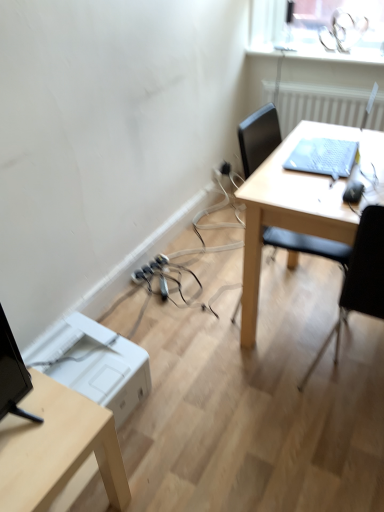
Question: Is black plastic extension cord at lower center smaller than black plastic chair at right?

Choices:
 (A) yes
 (B) no

Answer: (A)

Question: Does black plastic extension cord at lower center have a lesser height compared to black plastic chair at right?

Choices:
 (A) no
 (B) yes

Answer: (B)

Question: Can you confirm if black plastic extension cord at lower center is wider than black plastic chair at right?

Choices:
 (A) no
 (B) yes

Answer: (A)

Question: Is black plastic extension cord at lower center located outside black plastic chair at right?

Choices:
 (A) yes
 (B) no

Answer: (A)

Question: Is black plastic extension cord at lower center in front of black plastic chair at right?

Choices:
 (A) yes
 (B) no

Answer: (B)

Question: In the image, is light wood table at center positioned in front of or behind white plastic printer at lower left?

Choices:
 (A) front
 (B) behind

Answer: (A)

Question: In the image, is light wood table at center on the left side or the right side of white plastic printer at lower left?

Choices:
 (A) right
 (B) left

Answer: (A)

Question: Considering the positions of light wood table at center and white plastic printer at lower left in the image, is light wood table at center wider or thinner than white plastic printer at lower left?

Choices:
 (A) wide
 (B) thin

Answer: (A)

Question: From the image's perspective, is light wood table at center positioned above or below white plastic printer at lower left?

Choices:
 (A) below
 (B) above

Answer: (B)

Question: From the image's perspective, is white textured radiator at upper right above or below black plastic chair at right?

Choices:
 (A) above
 (B) below

Answer: (A)

Question: Considering the positions of white textured radiator at upper right and black plastic chair at right in the image, is white textured radiator at upper right bigger or smaller than black plastic chair at right?

Choices:
 (A) big
 (B) small

Answer: (B)

Question: Would you say white textured radiator at upper right is inside or outside black plastic chair at right?

Choices:
 (A) inside
 (B) outside

Answer: (B)

Question: In the image, is white textured radiator at upper right on the left side or the right side of black plastic chair at right?

Choices:
 (A) right
 (B) left

Answer: (B)

Question: Considering the positions of white plastic printer at lower left and black plastic chair at right in the image, is white plastic printer at lower left taller or shorter than black plastic chair at right?

Choices:
 (A) short
 (B) tall

Answer: (A)

Question: Considering the positions of point (71, 362) and point (357, 300), is point (71, 362) closer or farther from the camera than point (357, 300)?

Choices:
 (A) closer
 (B) farther

Answer: (B)